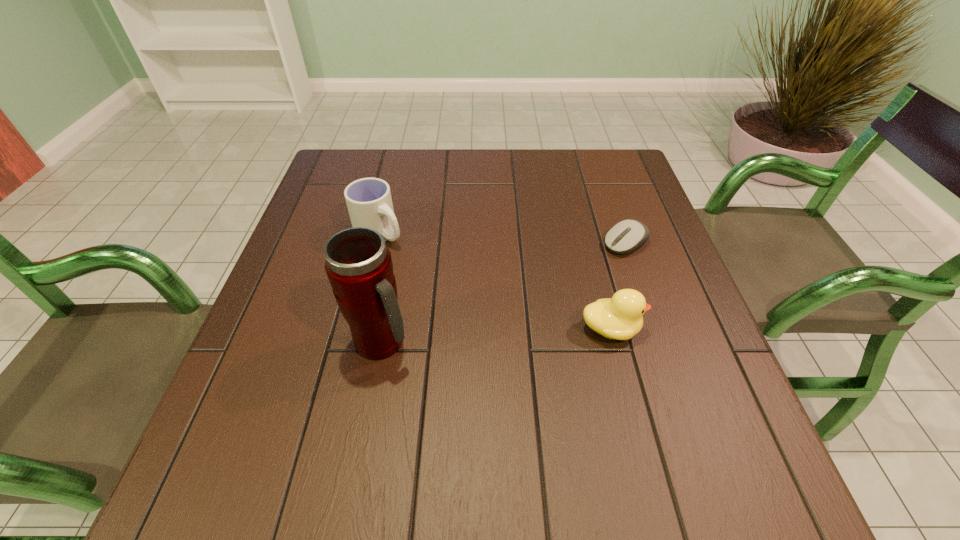
At what (x,y) coordinates should I click in order to perform the action: click on vacant space on the desktop that is between the thermos bottle and the duckling and is positioned with the handle on the side of the cup. Please return your answer as a coordinate pair (x, y). This screenshot has height=540, width=960. Looking at the image, I should click on (503, 335).

I want to click on vacant spot on the desktop that is between the thermos bottle and the duckling and is positioned on the wheel side of the computer equipment, so tap(478, 336).